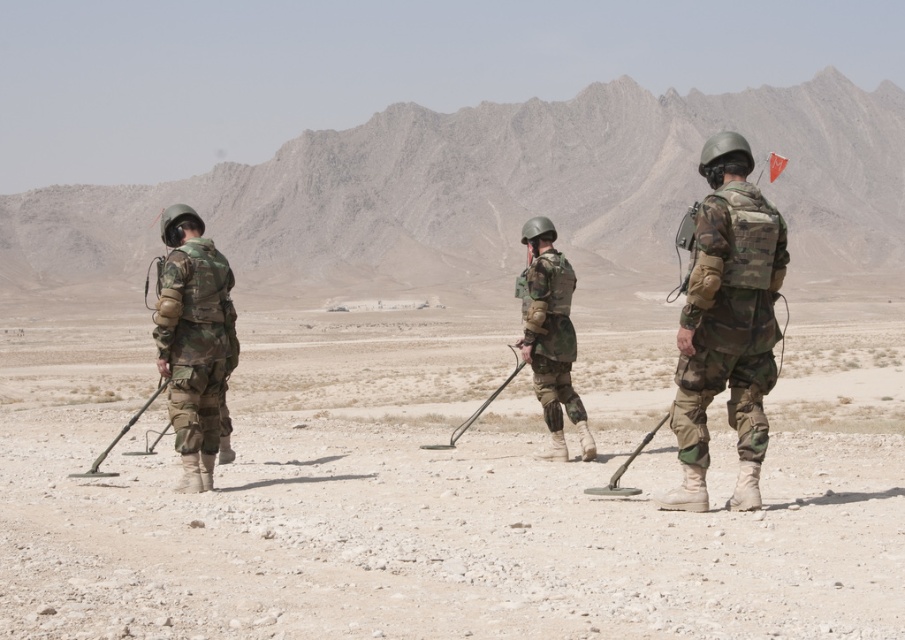
Can you confirm if camouflage fabric helmet at left is positioned to the left of metallic smooth detector at center?

Yes, camouflage fabric helmet at left is to the left of metallic smooth detector at center.

Locate an element on the screen. The height and width of the screenshot is (640, 905). camouflage fabric helmet at left is located at coordinates pyautogui.click(x=193, y=340).

Who is more distant from viewer, (694,376) or (418,445)?

The point (418,445) is behind.

This screenshot has width=905, height=640. What are the coordinates of `camouflage fabric vest at right` in the screenshot? It's located at (727, 323).

Is camouflage fabric helmet at center closer to camera compared to metallic gray metal detector at left?

No, it is not.

From the picture: Does camouflage fabric helmet at center have a lesser height compared to metallic gray metal detector at left?

No, camouflage fabric helmet at center is not shorter than metallic gray metal detector at left.

Who is more distant from viewer, (580, 422) or (136, 412)?

The point (136, 412) is more distant.

Find the location of a particular element. The height and width of the screenshot is (640, 905). camouflage fabric helmet at center is located at coordinates (550, 336).